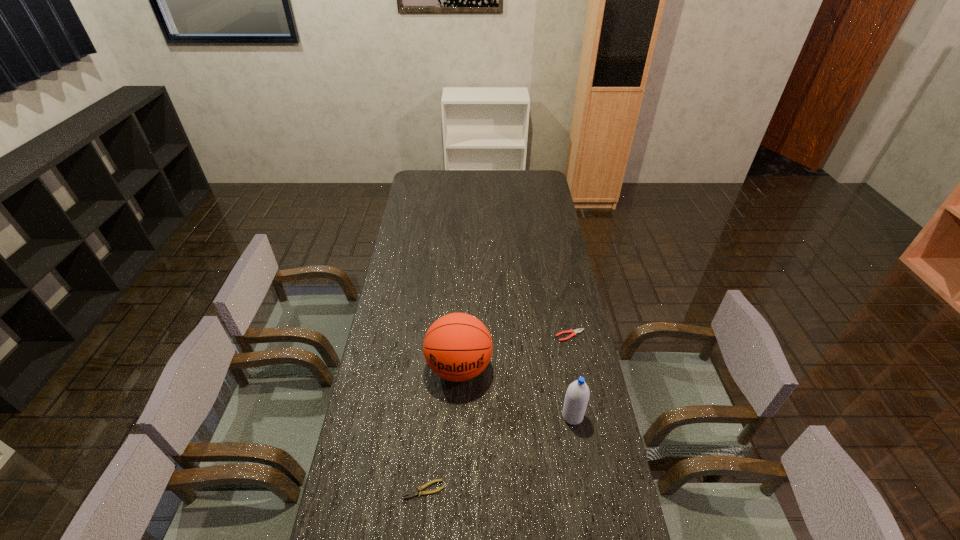
At what (x,y) coordinates should I click in order to perform the action: click on free point between the basketball and the second nearest object. Please return your answer as a coordinate pair (x, y). Looking at the image, I should click on (516, 392).

Find the location of a particular element. The height and width of the screenshot is (540, 960). free spot between the third tallest object and the water bottle is located at coordinates (571, 376).

Locate an element on the screen. free spot between the basketball and the third farthest object is located at coordinates (516, 392).

Find the location of a particular element. free spot between the third nearest object and the shortest object is located at coordinates (442, 429).

Find the location of a particular element. The height and width of the screenshot is (540, 960). vacant space that is in between the taller pliers and the basketball is located at coordinates (515, 352).

Locate an element on the screen. The width and height of the screenshot is (960, 540). free space between the left pliers and the water bottle is located at coordinates (498, 453).

This screenshot has height=540, width=960. I want to click on object that stands as the closest to the shortest object, so click(x=457, y=347).

Select which object appears as the second closest to the shortest object. Please provide its 2D coordinates. Your answer should be formatted as a tuple, i.e. [(x, y)], where the tuple contains the x and y coordinates of a point satisfying the conditions above.

[(577, 396)]

Find the location of a particular element. Image resolution: width=960 pixels, height=540 pixels. vacant region that satisfies the following two spatial constraints: 1. on the back side of the third tallest object; 2. on the right side of the shortest object is located at coordinates (439, 335).

Where is `vacant area that satisfies the following two spatial constraints: 1. on the side with logo of the second nearest object; 2. on the right side of the basketball`? vacant area that satisfies the following two spatial constraints: 1. on the side with logo of the second nearest object; 2. on the right side of the basketball is located at coordinates (457, 416).